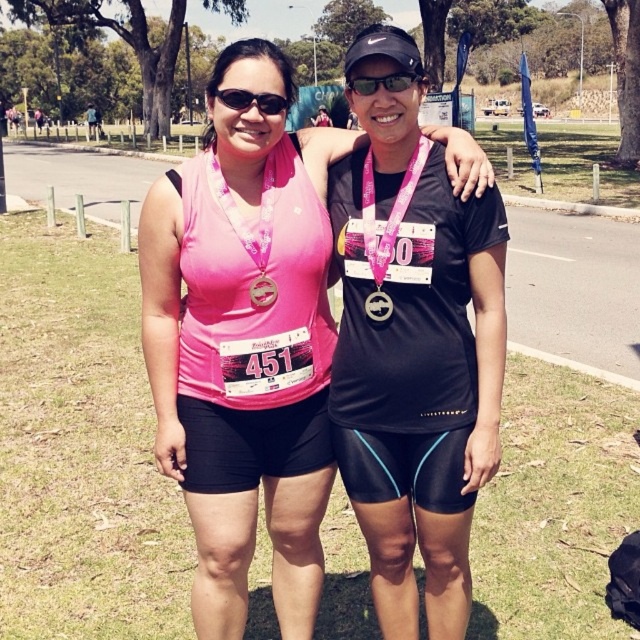
Can you confirm if black matte sunglasses at center is wider than metallic gold medal at center?

Yes, black matte sunglasses at center is wider than metallic gold medal at center.

Describe the element at coordinates (381, 83) in the screenshot. I see `black matte sunglasses at center` at that location.

The image size is (640, 640). I want to click on black matte sunglasses at center, so [381, 83].

Find the location of a particular element. The width and height of the screenshot is (640, 640). black matte sunglasses at center is located at coordinates (381, 83).

How much distance is there between matte black jersey at center and black matte sunglasses at center?

They are 38.58 centimeters apart.

Does matte black jersey at center lie in front of black matte sunglasses at center?

Yes.

Identify the location of matte black jersey at center. (413, 362).

Is matte pink tank top at center to the right of metallic gold medal at center from the viewer's perspective?

In fact, matte pink tank top at center is to the left of metallic gold medal at center.

Is point (246, 344) less distant than point (272, 289)?

Yes, point (246, 344) is in front of point (272, 289).

Which is behind, point (288, 572) or point (260, 288)?

The point (288, 572) is more distant.

Image resolution: width=640 pixels, height=640 pixels. What are the coordinates of `matte pink tank top at center` in the screenshot? It's located at (244, 342).